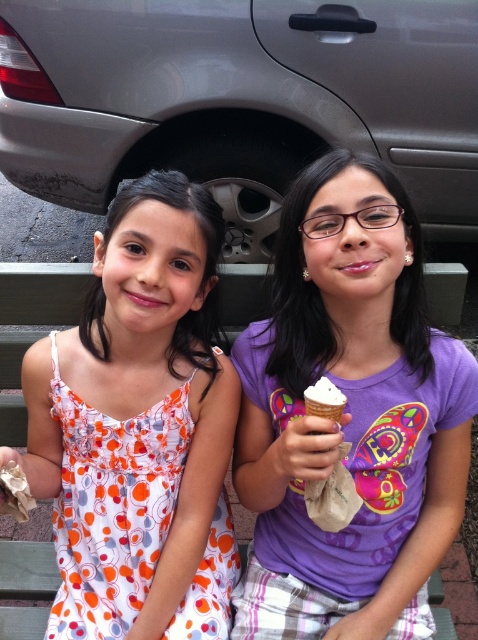
You are a photographer setting up a shot of the two girls. The silver metallic car at center and the white dotted dress at center are in the background. If you want to ensure both the car and the dress are fully visible in the frame, which object should you position closer to the camera?

The silver metallic car at center might be wider than white dotted dress at center, so you should position the car closer to the camera to ensure it fits within the frame.

You are a delivery robot with a 3.5 feet wide package. You need to move through the space between the silver metallic car at center and the white dotted dress at center. Can you fit through that space?

The distance between the silver metallic car at center and the white dotted dress at center is 4.79 feet. Since your package is 3.5 feet wide, you can fit through the space as 3.5 is less than 4.79.

You are a photographer trying to capture both the silver metallic car at center and the white dotted dress at center in the same frame. Given their sizes, which object should you focus on first to ensure both are clearly visible in your photo?

The silver metallic car at center is larger than the white dotted dress at center, so you should focus on the silver metallic car at center first to ensure both are clearly visible in the photo.